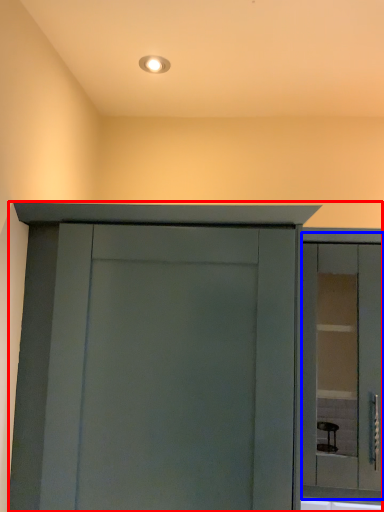
Question: Among these objects, which one is farthest to the camera, cupboard (highlighted by a red box) or window (highlighted by a blue box)?

Choices:
 (A) cupboard
 (B) window

Answer: (B)